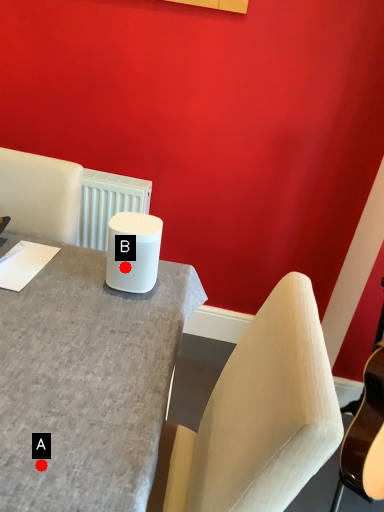
Question: Two points are circled on the image, labeled by A and B beside each circle. Among these points, which one is farthest from the camera?

Choices:
 (A) A is further
 (B) B is further

Answer: (B)